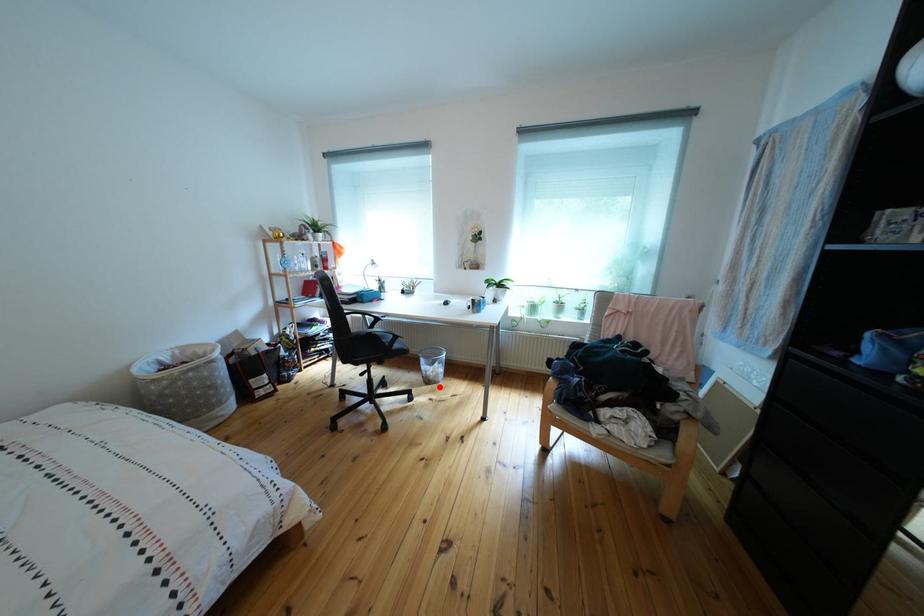
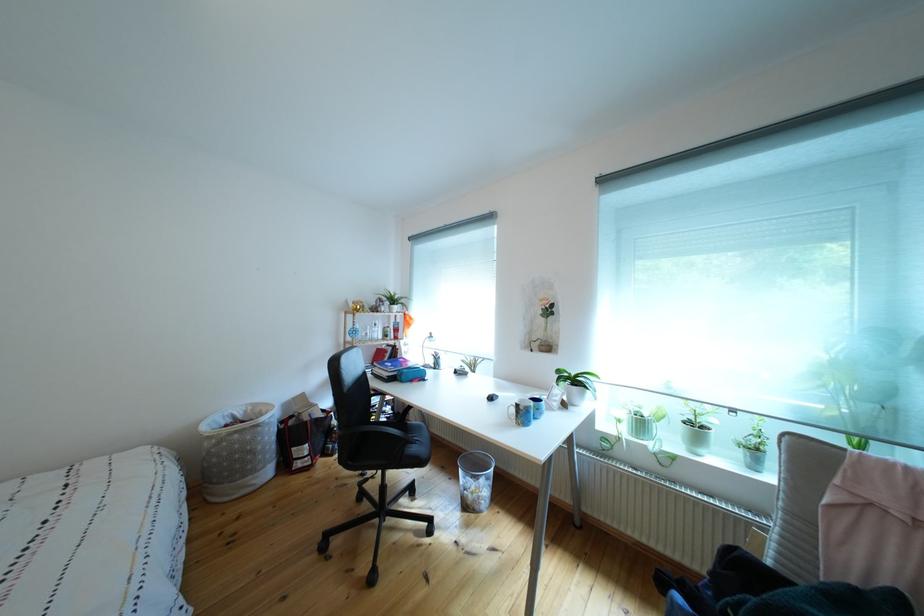
Question: I am providing you with two images of the same scene from different viewpoints. A red point is shown in image1. For the corresponding object point in image2, is it positioned nearer or farther from the camera?

Choices:
 (A) Nearer
 (B) Farther

Answer: (B)